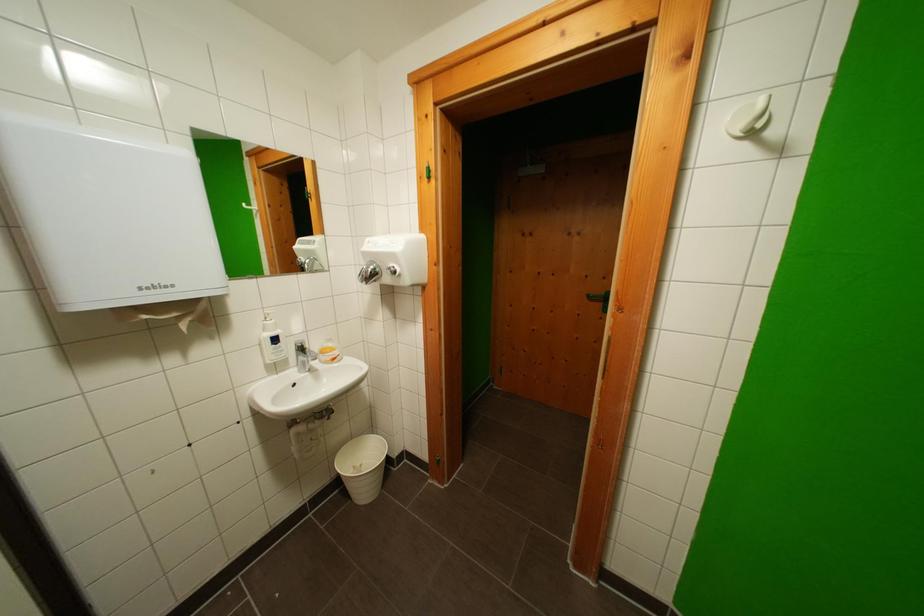
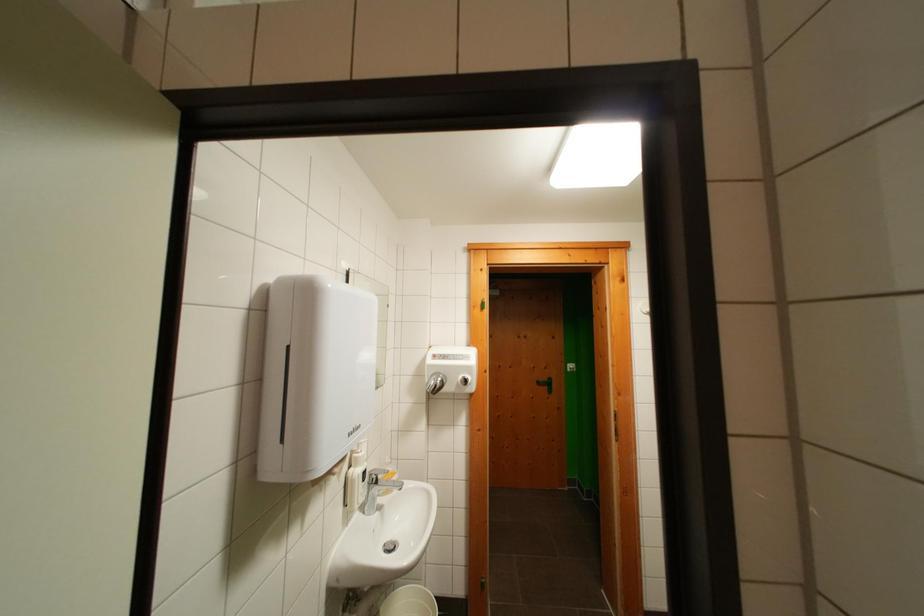
Based on the photo, the images are taken continuously from a first-person perspective. In which direction is your viewpoint rotating?

The camera's rotation is toward right-up.